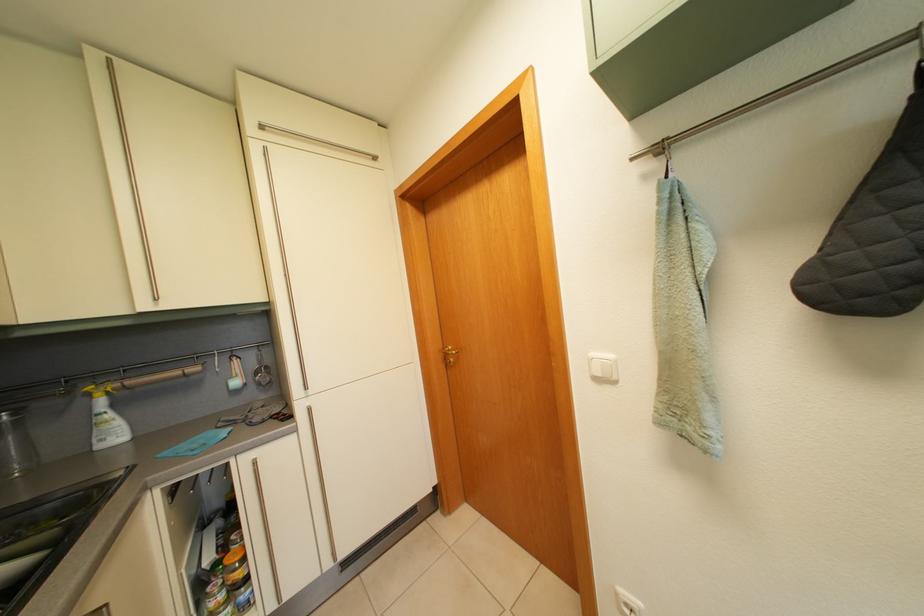
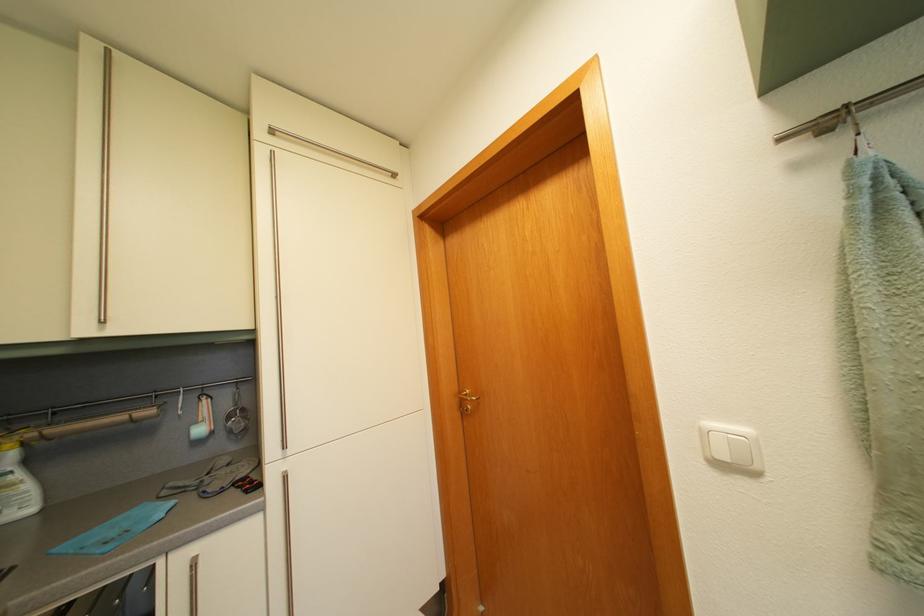
Locate, in the second image, the point that corresponds to point 264,381 in the first image.

(237, 424)